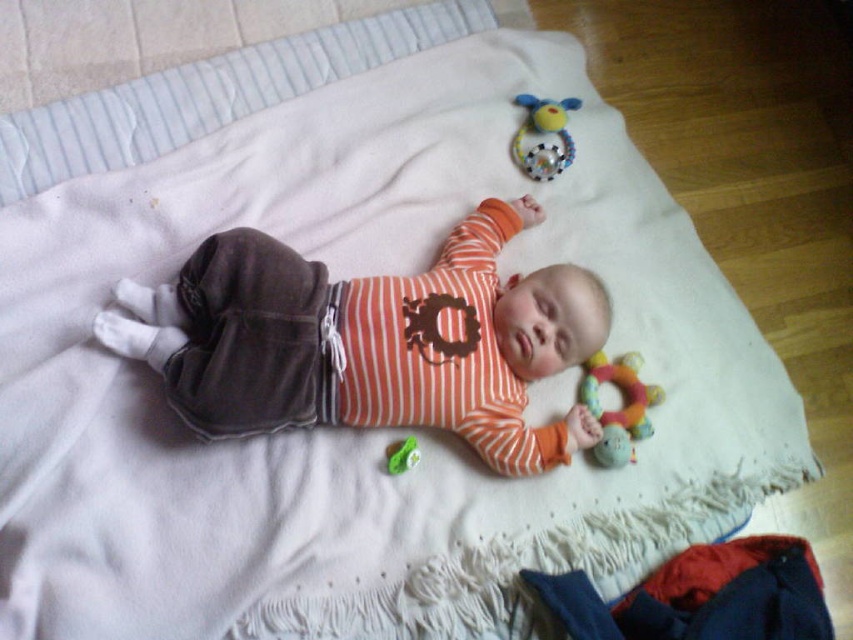
Question: Which point is farther to the camera?

Choices:
 (A) plush rubber rattle at upper right
 (B) multicolored rubber ring at lower right

Answer: (A)

Question: Is multicolored rubber ring at lower right below green rubber toy at center?

Choices:
 (A) no
 (B) yes

Answer: (A)

Question: Among these objects, which one is nearest to the camera?

Choices:
 (A) green rubber toy at center
 (B) multicolored rubber ring at lower right
 (C) matte orange striped shirt at center

Answer: (C)

Question: Which of these objects is positioned closest to the green rubber toy at center?

Choices:
 (A) matte orange striped shirt at center
 (B) multicolored rubber ring at lower right

Answer: (A)

Question: Is multicolored rubber ring at lower right smaller than plush rubber rattle at upper right?

Choices:
 (A) yes
 (B) no

Answer: (B)

Question: Can you confirm if matte orange striped shirt at center is smaller than green rubber toy at center?

Choices:
 (A) no
 (B) yes

Answer: (A)